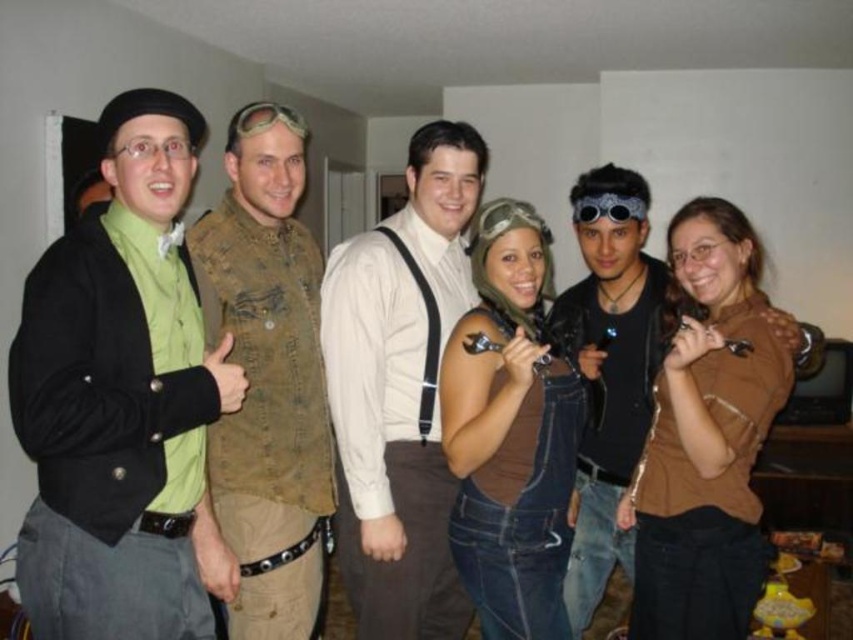
You are a photographer at the event and need to adjust the lighting between the white matte shirt at center and the leather vest at center. The minimum distance required for the lighting equipment to function properly is 8 inches. Based on the scene, can the equipment be used effectively between these two items?

The white matte shirt at center is 7.76 inches from the leather vest at center. Since the required minimum distance is 8 inches, the equipment cannot be used effectively between these two items as the distance is slightly less than required.

You are at a costume party and notice two pairs of goggles in the image. The metallic aviator goggles at upper center and the metallic silver goggles at center. Which pair of goggles is taller?

The metallic aviator goggles at upper center is taller than the metallic silver goggles at center.

You are organizing a steampunk costume party and need to arrange two pairs of goggles on a display shelf. The metallic aviator goggles at upper center and the metallic silver goggles at center must be placed such that their positions mirror the original image. If the shelf has limited space, which goggles should be placed on the left side of the shelf to maintain the correct spatial relationship?

To maintain the correct spatial relationship, the metallic aviator goggles at upper center should be placed on the left side of the shelf since they are originally positioned to the left of the metallic silver goggles at center in the image.